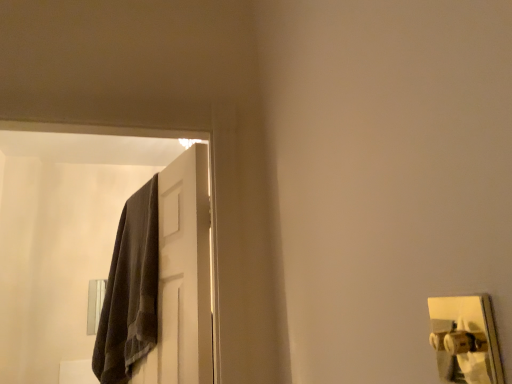
Question: Is metallic gold door handle at upper right at the back of white matte door at upper left?

Choices:
 (A) yes
 (B) no

Answer: (B)

Question: Considering the relative sizes of white matte door at upper left and metallic gold door handle at upper right in the image provided, is white matte door at upper left smaller than metallic gold door handle at upper right?

Choices:
 (A) no
 (B) yes

Answer: (A)

Question: Is white matte door at upper left aimed at metallic gold door handle at upper right?

Choices:
 (A) yes
 (B) no

Answer: (B)

Question: From a real-world perspective, is white matte door at upper left located beneath metallic gold door handle at upper right?

Choices:
 (A) no
 (B) yes

Answer: (A)

Question: Is white matte door at upper left to the left of metallic gold door handle at upper right from the viewer's perspective?

Choices:
 (A) no
 (B) yes

Answer: (B)

Question: Does white matte door at upper left have a lesser width compared to metallic gold door handle at upper right?

Choices:
 (A) no
 (B) yes

Answer: (B)

Question: Could you tell me if metallic gold door handle at upper right is facing white matte door at upper left?

Choices:
 (A) no
 (B) yes

Answer: (A)

Question: Is metallic gold door handle at upper right at the left side of white matte door at upper left?

Choices:
 (A) no
 (B) yes

Answer: (A)

Question: Considering the relative sizes of metallic gold door handle at upper right and white matte door at upper left in the image provided, is metallic gold door handle at upper right taller than white matte door at upper left?

Choices:
 (A) no
 (B) yes

Answer: (A)

Question: Is metallic gold door handle at upper right in front of white matte door at upper left?

Choices:
 (A) yes
 (B) no

Answer: (A)

Question: Is metallic gold door handle at upper right not near white matte door at upper left?

Choices:
 (A) no
 (B) yes

Answer: (B)

Question: From a real-world perspective, is metallic gold door handle at upper right over white matte door at upper left?

Choices:
 (A) no
 (B) yes

Answer: (A)

Question: Is white matte door at upper left in front of or behind metallic gold door handle at upper right in the image?

Choices:
 (A) front
 (B) behind

Answer: (B)